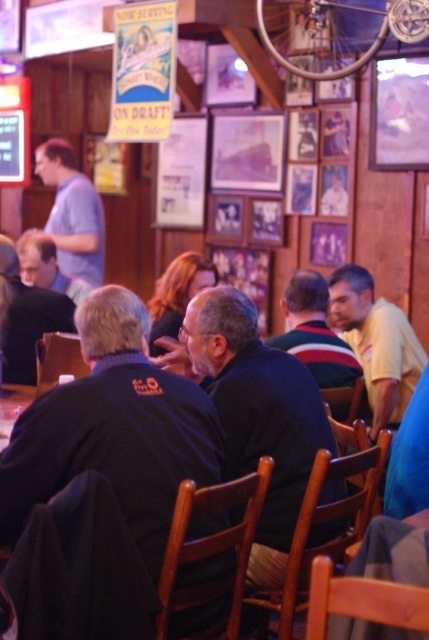
Question: Is dark blue shirt at center positioned in front of dark blue sweater at center?

Choices:
 (A) yes
 (B) no

Answer: (A)

Question: Which object is positioned farthest from the dark blue sweater at center?

Choices:
 (A) dark blue shirt at center
 (B) light blue shirt at left

Answer: (B)

Question: Can you confirm if dark blue sweater at center is positioned above light blue shirt at left?

Choices:
 (A) no
 (B) yes

Answer: (A)

Question: Which point is closer to the camera?

Choices:
 (A) (196, 401)
 (B) (87, 275)

Answer: (A)

Question: Which object is farther from the camera taking this photo?

Choices:
 (A) dark blue shirt at center
 (B) dark blue sweater at center
 (C) light blue shirt at left

Answer: (C)

Question: Can you confirm if dark blue shirt at center is positioned to the right of dark blue sweater at center?

Choices:
 (A) no
 (B) yes

Answer: (A)